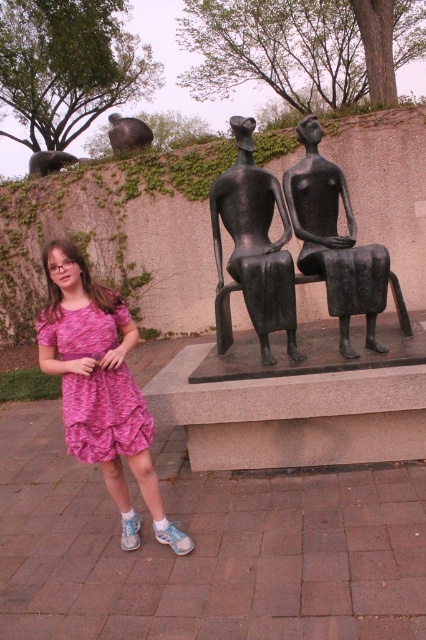
Question: Is pink textured dress at lower left smaller than bronze statue at upper center?

Choices:
 (A) no
 (B) yes

Answer: (B)

Question: Which of these objects is positioned closest to the bronze statue at center?

Choices:
 (A) bronze statue at upper center
 (B) pink fabric dress at lower left

Answer: (B)

Question: Is pink fabric dress at lower left to the right of bronze statue at center from the viewer's perspective?

Choices:
 (A) yes
 (B) no

Answer: (B)

Question: Among these points, which one is nearest to the camera?

Choices:
 (A) (143, 449)
 (B) (328, 211)

Answer: (A)

Question: Is bronze sculpture at center smaller than bronze statue at upper center?

Choices:
 (A) yes
 (B) no

Answer: (A)

Question: Which point is closer to the camera taking this photo?

Choices:
 (A) (336, 285)
 (B) (132, 124)

Answer: (A)